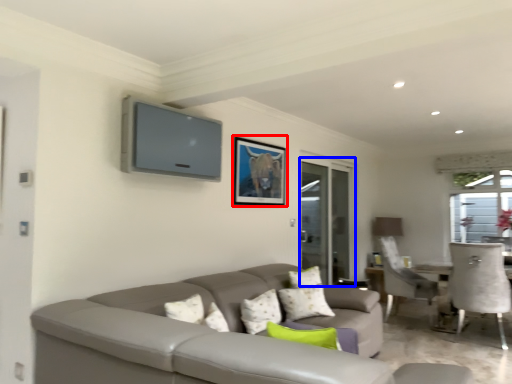
Question: Which point is further to the camera, picture frame (highlighted by a red box) or screen door (highlighted by a blue box)?

Choices:
 (A) picture frame
 (B) screen door

Answer: (B)